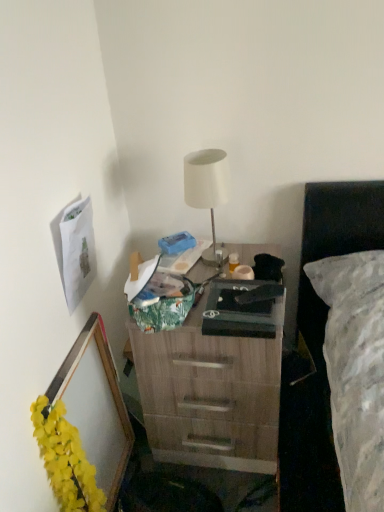
Question: Would you say white matte lamp at center is inside or outside wooden picture frame at lower left?

Choices:
 (A) inside
 (B) outside

Answer: (B)

Question: Is white matte lamp at center wider or thinner than wooden picture frame at lower left?

Choices:
 (A) wide
 (B) thin

Answer: (A)

Question: Estimate the real-world distances between objects in this image. Which object is farther from the yellow fabric garland at lower left?

Choices:
 (A) wooden desk at center
 (B) white matte lamp at center
 (C) matte black box at center
 (D) wooden picture frame at lower left

Answer: (B)

Question: Based on their relative distances, which object is farther from the wooden desk at center?

Choices:
 (A) yellow fabric garland at lower left
 (B) matte black box at center
 (C) wooden picture frame at lower left
 (D) white matte lamp at center

Answer: (D)